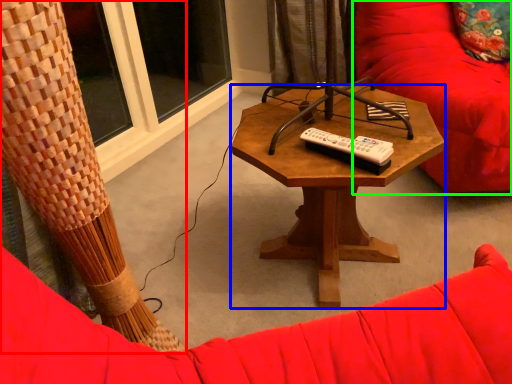
Question: Considering the real-world distances, which object is farthest from curtain (highlighted by a red box)? coffee table (highlighted by a blue box) or swivel chair (highlighted by a green box)?

Choices:
 (A) coffee table
 (B) swivel chair

Answer: (B)